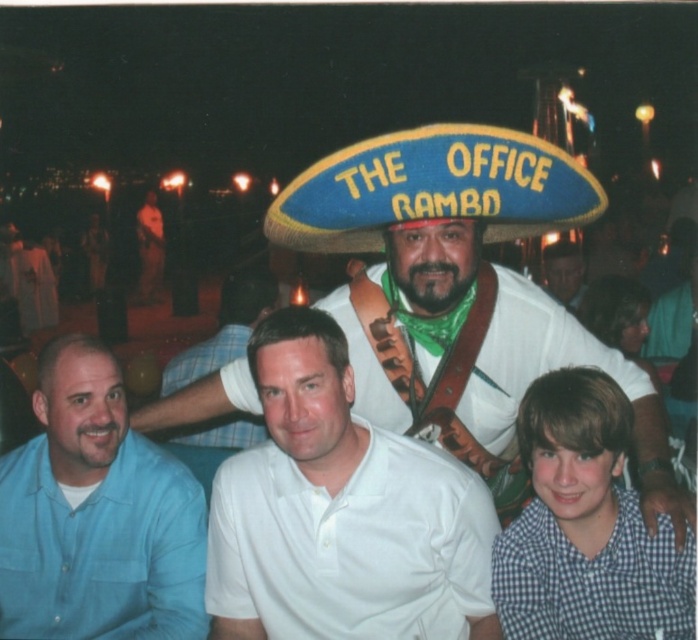
Is point (514, 292) more distant than point (560, 243)?

No, it is not.

Is white fabric shirt at center bigger than matte white shirt at center?

Yes.

Does point (655, 490) lie behind point (560, 273)?

That is False.

Where is `white fabric shirt at center`? This screenshot has width=698, height=640. white fabric shirt at center is located at coordinates tap(461, 289).

Who is positioned more to the right, blue felt sombrero at center or matte white shirt at center?

Positioned to the right is matte white shirt at center.

Is blue felt sombrero at center taller than matte white shirt at center?

No.

Is point (431, 134) farther from viewer compared to point (549, 280)?

No, (431, 134) is in front of (549, 280).

Find the location of a particular element. blue felt sombrero at center is located at coordinates (433, 188).

Who is taller, white fabric shirt at center or white cotton polo shirt at center?

white fabric shirt at center

Is white fabric shirt at center positioned behind white cotton polo shirt at center?

No, white fabric shirt at center is closer to the viewer.

Which is in front, point (571, 225) or point (262, 472)?

Point (262, 472)

The width and height of the screenshot is (698, 640). I want to click on white fabric shirt at center, so click(461, 289).